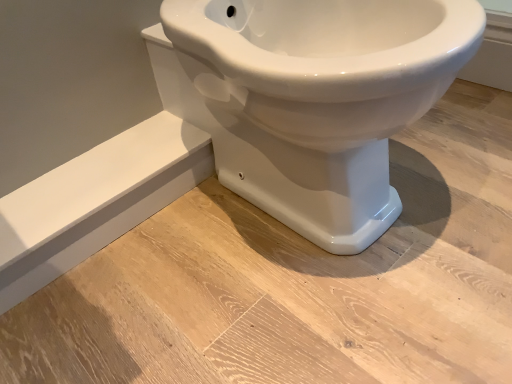
Measure the distance between white glossy toilet at center and camera.

A distance of 19.22 inches exists between white glossy toilet at center and camera.

Describe the element at coordinates (311, 98) in the screenshot. I see `white glossy toilet at center` at that location.

Where is `white glossy toilet at center`? The width and height of the screenshot is (512, 384). white glossy toilet at center is located at coordinates (311, 98).

In order to click on white glossy toilet at center in this screenshot , I will do `click(311, 98)`.